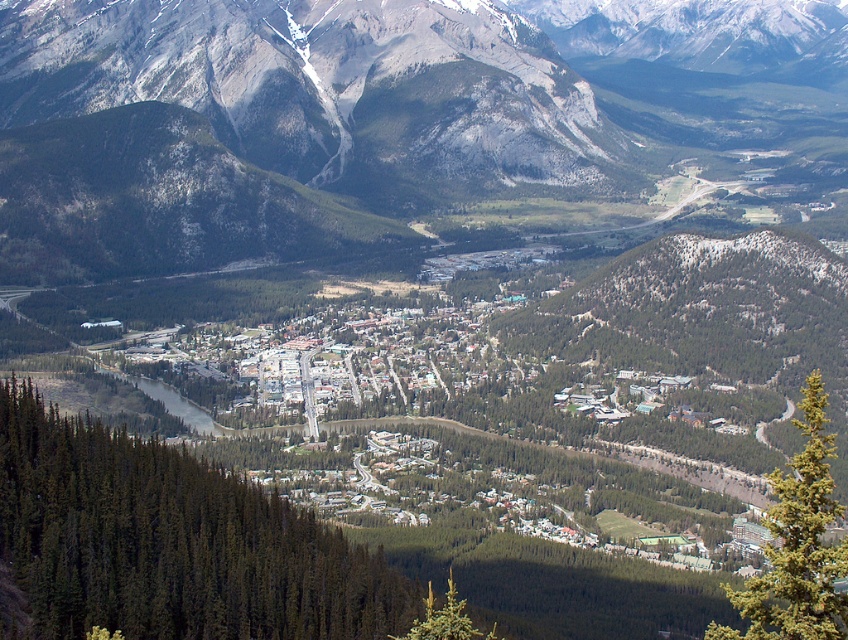
Question: Is green matte tree at center positioned at the back of green needle-like tree at lower right?

Choices:
 (A) no
 (B) yes

Answer: (B)

Question: Among these objects, which one is nearest to the camera?

Choices:
 (A) gray rocky mountain range at center
 (B) green textured pine tree at lower center

Answer: (B)

Question: Is green matte tree at center further to camera compared to green needle-like tree at lower right?

Choices:
 (A) yes
 (B) no

Answer: (A)

Question: Estimate the real-world distances between objects in this image. Which object is closer to the gray rocky mountain range at center?

Choices:
 (A) green textured pine tree at lower center
 (B) green needle-like tree at lower right
 (C) green matte tree at center

Answer: (C)

Question: Is green matte tree at center wider than green textured pine tree at lower center?

Choices:
 (A) no
 (B) yes

Answer: (B)

Question: Which object is the closest to the green textured pine tree at lower center?

Choices:
 (A) gray rocky mountain range at center
 (B) green needle-like tree at lower right

Answer: (B)